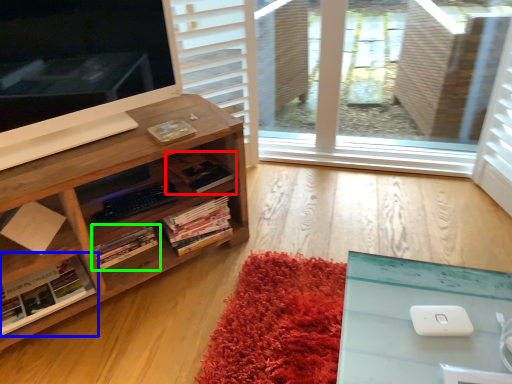
Question: Estimate the real-world distances between objects in this image. Which object is closer to book (highlighted by a red box), book (highlighted by a blue box) or book (highlighted by a green box)?

Choices:
 (A) book
 (B) book

Answer: (B)